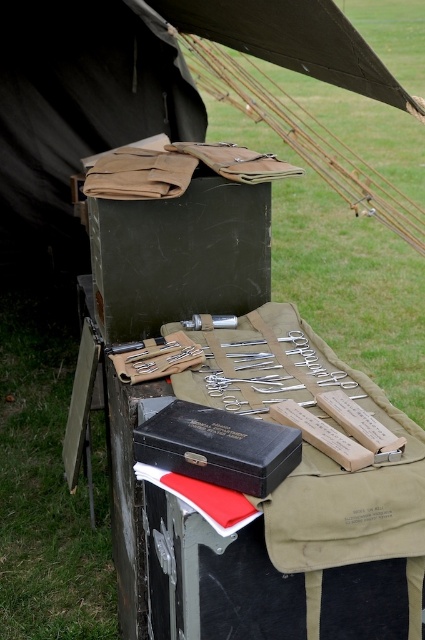
Does black matte box at center appear over matte brown canvas tent at upper center?

Actually, black matte box at center is below matte brown canvas tent at upper center.

Which is more to the left, black matte box at center or matte brown canvas tent at upper center?

matte brown canvas tent at upper center is more to the left.

Identify the location of black matte box at center. This screenshot has width=425, height=640. (274, 506).

The width and height of the screenshot is (425, 640). Identify the location of black matte box at center. (274, 506).

Can you confirm if black leather box at center is taller than metallic silver tool at center?

Yes, black leather box at center is taller than metallic silver tool at center.

Which is above, black leather box at center or metallic silver tool at center?

Positioned higher is metallic silver tool at center.

Between point (240, 458) and point (200, 326), which one is positioned behind?

The point (200, 326) is more distant.

Identify the location of black leather box at center. This screenshot has width=425, height=640. (218, 445).

Does black matte box at center have a lesser height compared to metallic silver tool at center?

No.

Can you confirm if black matte box at center is bigger than metallic silver tool at center?

Indeed, black matte box at center has a larger size compared to metallic silver tool at center.

Between point (209, 545) and point (226, 317), which one is positioned behind?

The point (226, 317) is more distant.

Where is `black matte box at center`? black matte box at center is located at coordinates (274, 506).